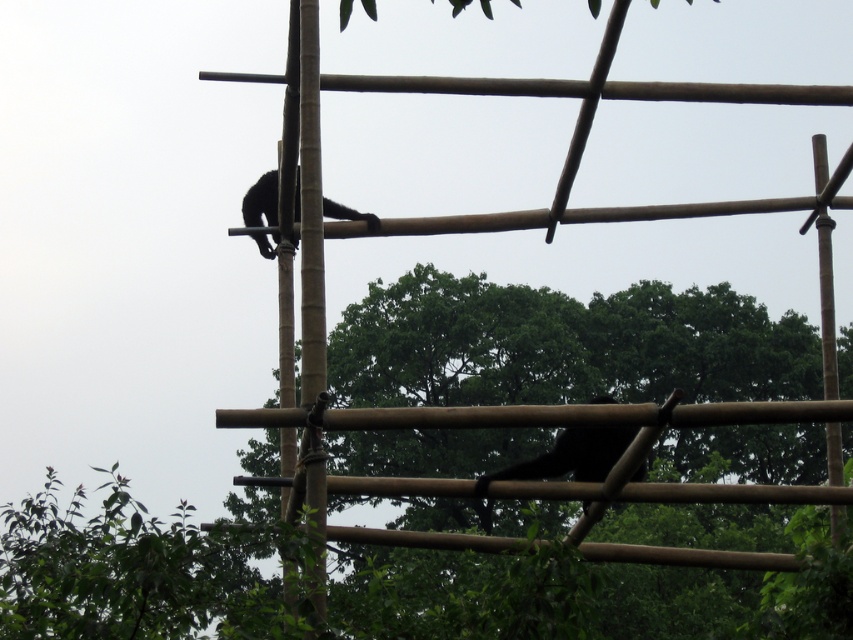
You are a construction worker standing near the green leafy tree at center and looking towards the brown bamboo pole at upper left. Which object is nearer to you?

The green leafy tree at center is closer to the viewer than the brown bamboo pole at upper left, so the green leafy tree at center is nearer to you.

You are a wildlife photographer aiming to capture both the black matte monkey at lower right and the black fur monkey at upper center in a single frame. Which monkey will appear smaller in your photo?

The black matte monkey at lower right will appear smaller in the photo because its width is less than that of the black fur monkey at upper center.

You are a construction worker inspecting the bamboo scaffolding. You notice two monkeys on the structure. One is a black matte monkey at lower right and the other is a black fur monkey at upper center. Which monkey is taller?

The black matte monkey at lower right is taller than the black fur monkey at upper center according to the description.